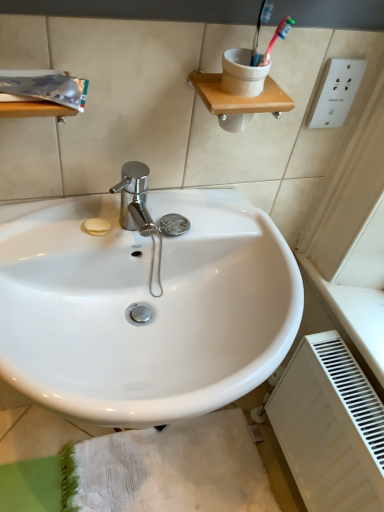
Question: From the image's perspective, is white textured bath mat at lower center positioned above or below white glossy sink at center?

Choices:
 (A) above
 (B) below

Answer: (B)

Question: Considering the positions of point (246, 423) and point (13, 348), is point (246, 423) closer or farther from the camera than point (13, 348)?

Choices:
 (A) farther
 (B) closer

Answer: (A)

Question: Which object is positioned farthest from the white textured bath mat at lower center?

Choices:
 (A) white plastic electric outlet at upper right
 (B) white glossy sink at center
 (C) white matte radiator at lower right

Answer: (A)

Question: Which of these objects is positioned farthest from the white matte radiator at lower right?

Choices:
 (A) white textured bath mat at lower center
 (B) white glossy sink at center
 (C) white plastic electric outlet at upper right

Answer: (C)